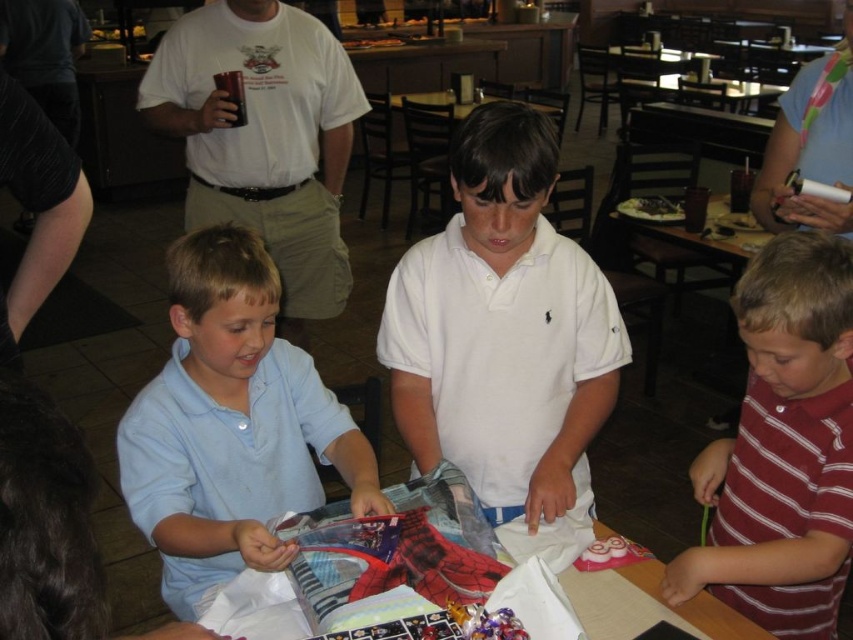
Question: Does white cotton t-shirt at upper center lie behind wooden table at center?

Choices:
 (A) no
 (B) yes

Answer: (A)

Question: Which object is farther from the camera taking this photo?

Choices:
 (A) light blue cotton shirt at lower left
 (B) shiny plastic table at center

Answer: (B)

Question: Does shiny plastic table at center appear on the left side of wooden table at center?

Choices:
 (A) no
 (B) yes

Answer: (B)

Question: Which object is farther from the camera taking this photo?

Choices:
 (A) white cotton shirt at center
 (B) pink fabric scarf at upper right
 (C) shiny plastic table at center
 (D) light blue cotton shirt at lower left

Answer: (B)

Question: Among these points, which one is nearest to the camera?

Choices:
 (A) (155, 540)
 (B) (729, 627)
 (C) (799, 509)
 (D) (189, 83)

Answer: (B)

Question: Is light blue cotton shirt at lower left thinner than white cotton t-shirt at upper center?

Choices:
 (A) yes
 (B) no

Answer: (A)